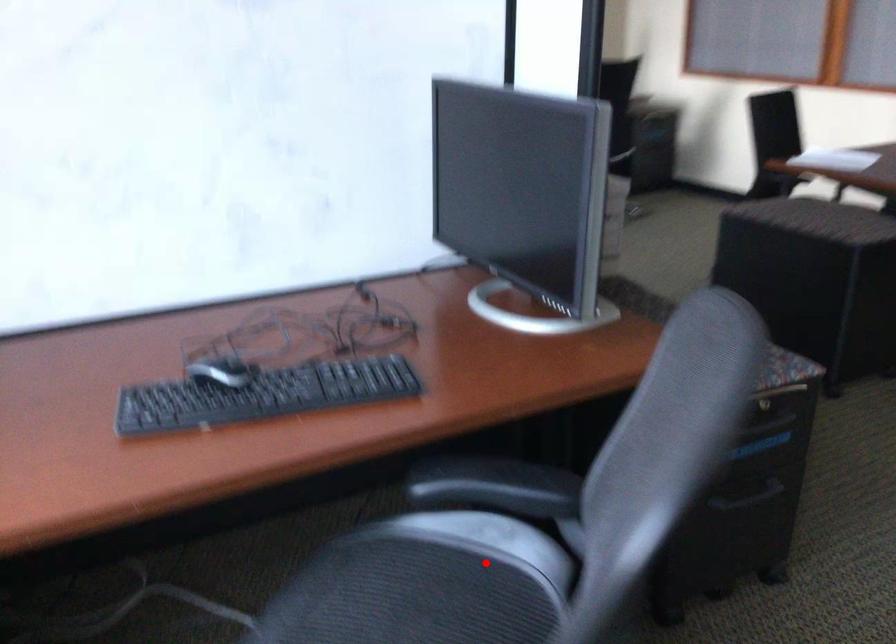
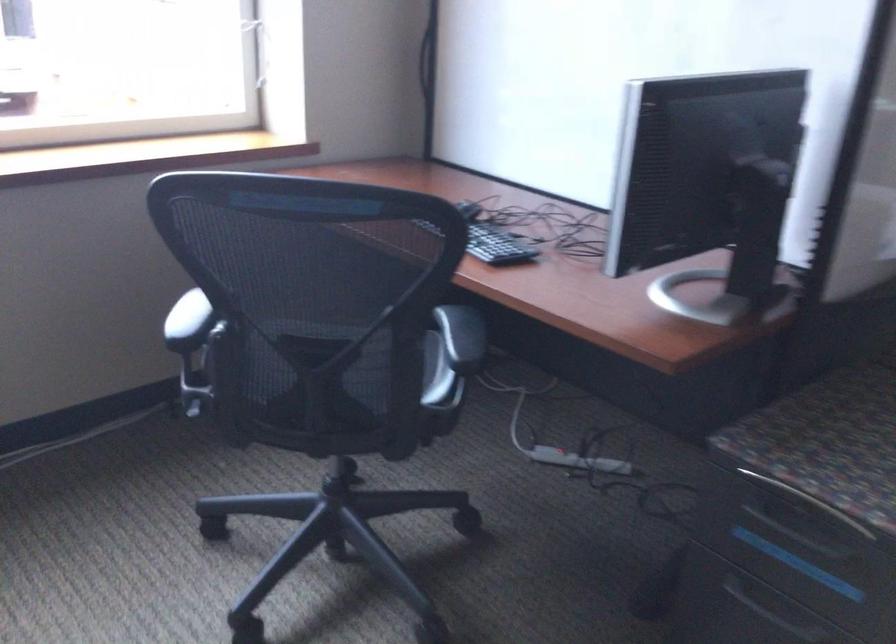
Question: I am providing you with two images of the same scene from different viewpoints. In image1, a red point is highlighted. Considering the same 3D point in image2, which of the following is correct?

Choices:
 (A) It is closer
 (B) It is farther

Answer: (B)